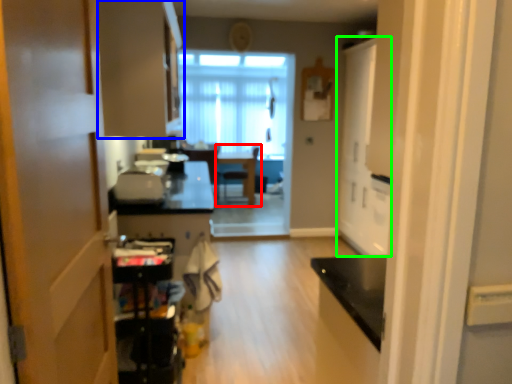
Question: Which is nearer to the chair (highlighted by a red box)? cabinetry (highlighted by a blue box) or door (highlighted by a green box).

Choices:
 (A) cabinetry
 (B) door

Answer: (B)